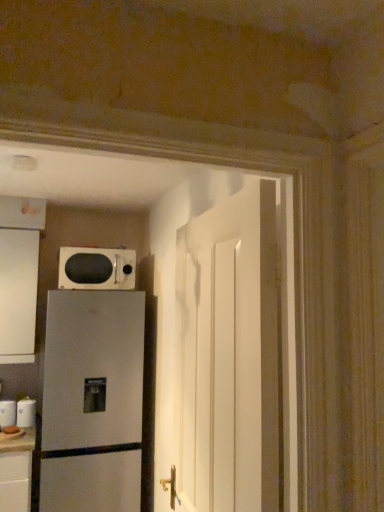
Question: Can you confirm if white glossy door at center is wider than satin silver refrigerator at lower left?

Choices:
 (A) no
 (B) yes

Answer: (A)

Question: From the image's perspective, would you say white glossy door at center is shown under satin silver refrigerator at lower left?

Choices:
 (A) no
 (B) yes

Answer: (A)

Question: Can you confirm if white glossy door at center is positioned to the right of satin silver refrigerator at lower left?

Choices:
 (A) no
 (B) yes

Answer: (B)

Question: Is white glossy door at center smaller than satin silver refrigerator at lower left?

Choices:
 (A) no
 (B) yes

Answer: (B)

Question: Is white glossy door at center bigger than satin silver refrigerator at lower left?

Choices:
 (A) no
 (B) yes

Answer: (A)

Question: Is white glossy door at center to the left of satin silver refrigerator at lower left from the viewer's perspective?

Choices:
 (A) yes
 (B) no

Answer: (B)

Question: Can you see white glossy door at center touching white glossy microwave at upper center?

Choices:
 (A) no
 (B) yes

Answer: (A)

Question: Is white glossy door at center oriented towards white glossy microwave at upper center?

Choices:
 (A) yes
 (B) no

Answer: (B)

Question: From a real-world perspective, is white glossy door at center over white glossy microwave at upper center?

Choices:
 (A) yes
 (B) no

Answer: (B)

Question: Considering the relative sizes of white glossy door at center and white glossy microwave at upper center in the image provided, is white glossy door at center smaller than white glossy microwave at upper center?

Choices:
 (A) yes
 (B) no

Answer: (B)

Question: Can you confirm if white glossy door at center is taller than white glossy microwave at upper center?

Choices:
 (A) no
 (B) yes

Answer: (B)

Question: Does white glossy door at center have a lesser width compared to white glossy microwave at upper center?

Choices:
 (A) no
 (B) yes

Answer: (B)

Question: From a real-world perspective, is white glossy mug at lower left, which is counted as the second appliance, starting from the right, physically below white glossy paper towel dispenser at lower left, which is the first appliance in right-to-left order?

Choices:
 (A) no
 (B) yes

Answer: (B)